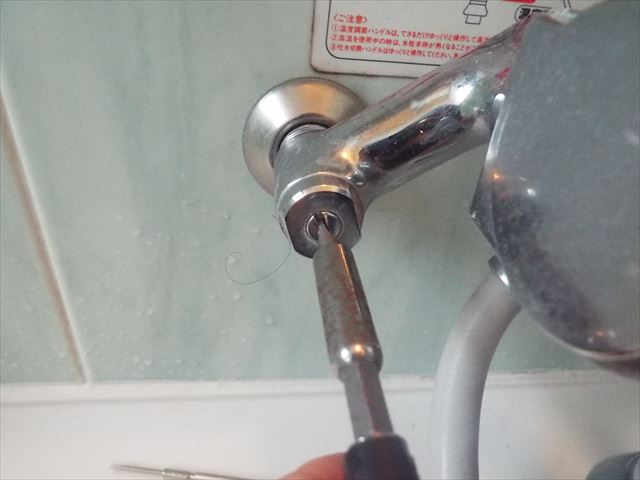
Locate an element on the screen. wall is located at coordinates (162, 226).